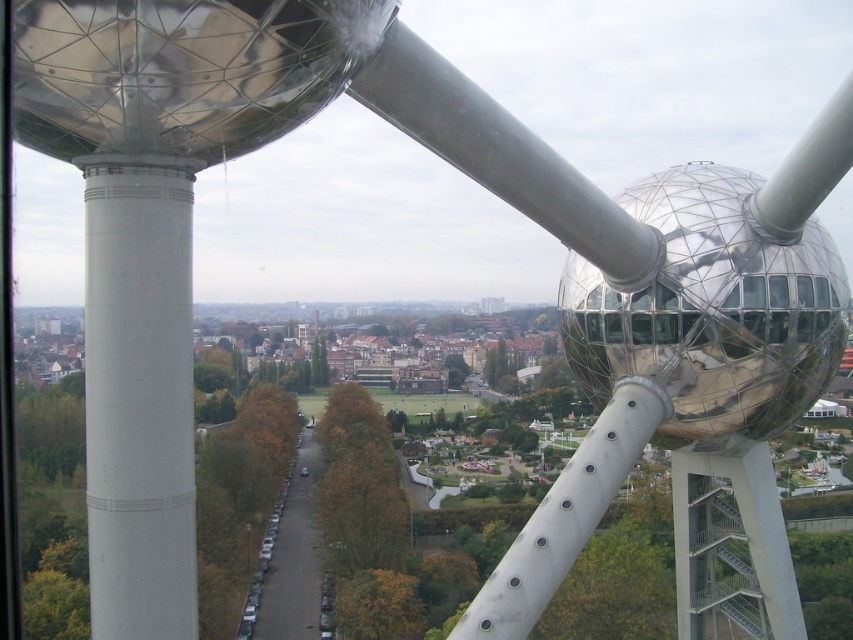
Question: Does polished metallic sphere at right come behind white metallic pole at center?

Choices:
 (A) yes
 (B) no

Answer: (A)

Question: Which point is closer to the camera taking this photo?

Choices:
 (A) (730, 428)
 (B) (184, 406)
 (C) (546, 515)

Answer: (B)

Question: Does polished metallic sphere at right appear on the left side of white smooth pillar at left?

Choices:
 (A) no
 (B) yes

Answer: (A)

Question: Among these points, which one is nearest to the camera?

Choices:
 (A) (476, 608)
 (B) (140, 292)
 (C) (671, 202)

Answer: (B)

Question: Which of the following is the closest to the observer?

Choices:
 (A) white metallic pole at center
 (B) polished metallic sphere at right

Answer: (A)

Question: Is the position of white smooth pillar at left less distant than that of white metallic pole at center?

Choices:
 (A) yes
 (B) no

Answer: (A)